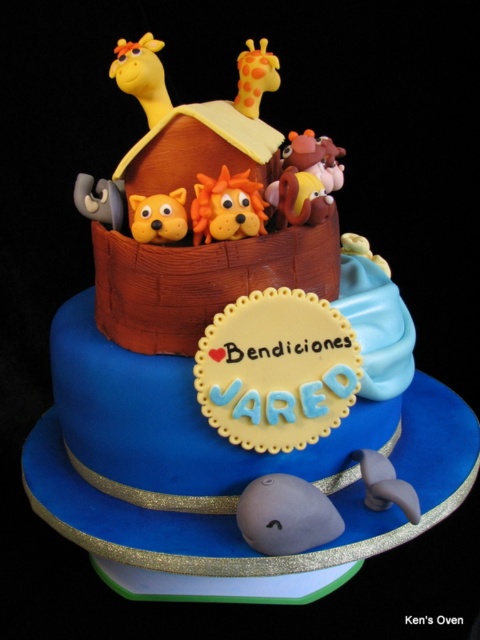
Question: Can you confirm if yellow fondant giraffe at upper left is smaller than orange matte dog at center?

Choices:
 (A) yes
 (B) no

Answer: (B)

Question: Does orange matte dog at center appear under matte brown bear at upper center?

Choices:
 (A) yes
 (B) no

Answer: (A)

Question: Which object is farther from the camera taking this photo?

Choices:
 (A) matte orange lion at center
 (B) yellow fondant giraffe at upper left
 (C) matte brown bear at upper center
 (D) matte orange giraffe at upper center

Answer: (C)

Question: Which point is farther from the camera taking this photo?

Choices:
 (A) (196, 243)
 (B) (183, 221)
 (C) (244, 83)

Answer: (C)

Question: Is matte orange lion at center smaller than yellow fondant giraffe at upper left?

Choices:
 (A) yes
 (B) no

Answer: (A)

Question: Considering the real-world distances, which object is closest to the yellow fondant giraffe at upper left?

Choices:
 (A) matte brown bear at upper center
 (B) orange matte dog at center
 (C) matte orange lion at center
 (D) matte orange giraffe at upper center

Answer: (D)